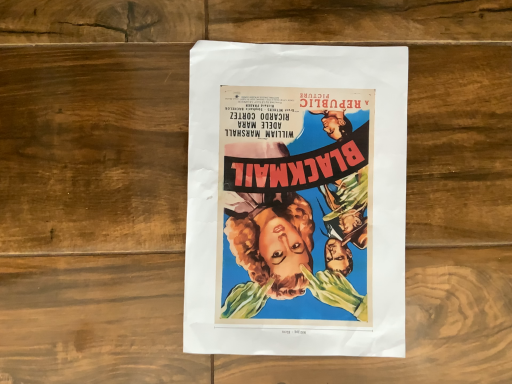
Identify the location of free point above vibrant paper poster at center (from a real-world perspective). This screenshot has width=512, height=384. (306, 195).